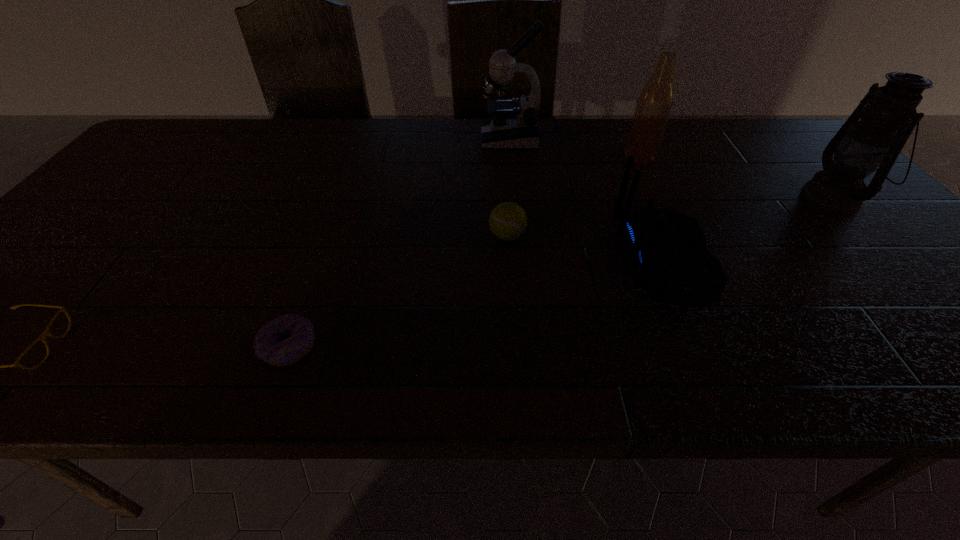
This screenshot has width=960, height=540. What are the coordinates of `free space located on the back of the fourth tallest object` in the screenshot? It's located at (539, 260).

What are the coordinates of `free space located on the back of the fourth tallest object` in the screenshot? It's located at (453, 260).

Locate an element on the screen. The image size is (960, 540). blank space located 0.350m on the left of the tennis ball is located at coordinates (340, 236).

Locate an element on the screen. Image resolution: width=960 pixels, height=540 pixels. vacant area situated on the right of the sixth object from right to left is located at coordinates (499, 347).

Locate an element on the screen. This screenshot has width=960, height=540. microscope situated at the far edge is located at coordinates (515, 125).

Identify the location of beer bottle that is at the far edge. (656, 99).

Locate an element on the screen. This screenshot has height=540, width=960. object present at the near edge is located at coordinates (271, 345).

Find the location of a particular element. object situated at the right edge is located at coordinates (888, 114).

You are a GUI agent. You are given a task and a screenshot of the screen. Output one action in this format:
    pyautogui.click(x=<x>, y=<y>)
    Task: Click on the vacant area at the far edge of the desktop
    
    Given the screenshot: What is the action you would take?
    pyautogui.click(x=354, y=135)

In the image, there is a desktop. Identify the location of vacant space at the near edge. (528, 359).